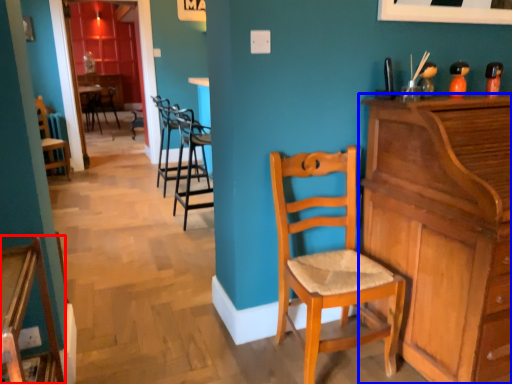
Question: Which point is further to the camera, chair (highlighted by a red box) or cabinetry (highlighted by a blue box)?

Choices:
 (A) chair
 (B) cabinetry

Answer: (B)